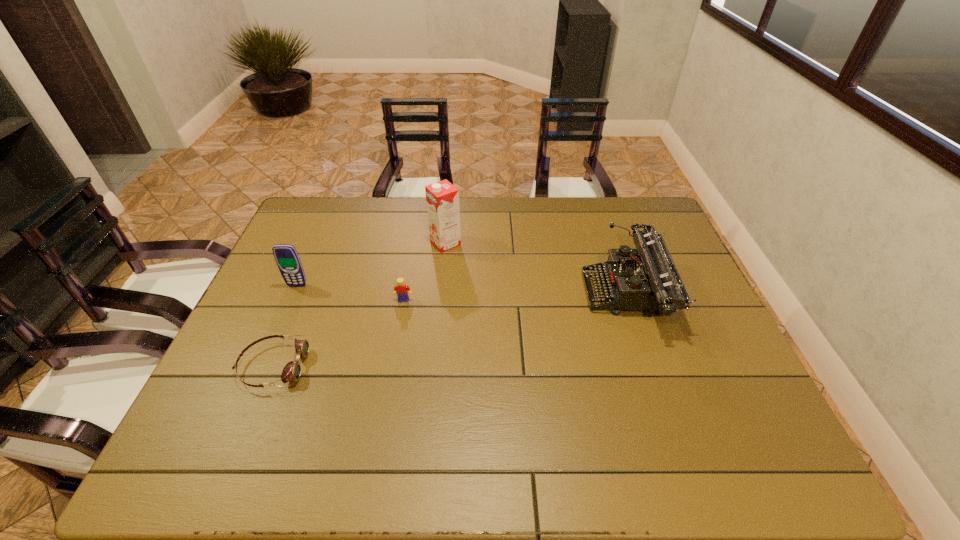
Find the location of a particular element. The width and height of the screenshot is (960, 540). carton is located at coordinates (442, 198).

The height and width of the screenshot is (540, 960). I want to click on the tallest object, so click(442, 198).

The image size is (960, 540). Find the location of `cellular telephone`. cellular telephone is located at coordinates 288,261.

You are a GUI agent. You are given a task and a screenshot of the screen. Output one action in this format:
    pyautogui.click(x=<x>, y=<y>)
    Task: Click on the typewriter
    
    Given the screenshot: What is the action you would take?
    pyautogui.click(x=650, y=281)

Identify the location of the fourth tallest object. (402, 290).

Locate an element on the screen. Lego is located at coordinates (402, 290).

The image size is (960, 540). I want to click on the shortest object, so click(291, 372).

I want to click on free space located 0.090m on the left of the carton, so click(402, 244).

Image resolution: width=960 pixels, height=540 pixels. Find the location of `vacant space situated 0.330m on the front-facing side of the cellular telephone`. vacant space situated 0.330m on the front-facing side of the cellular telephone is located at coordinates (255, 383).

At what (x,y) coordinates should I click in order to perform the action: click on vacant space located 0.070m on the keyboard of the typewriter. Please return your answer as a coordinate pair (x, y). The height and width of the screenshot is (540, 960). Looking at the image, I should click on (561, 294).